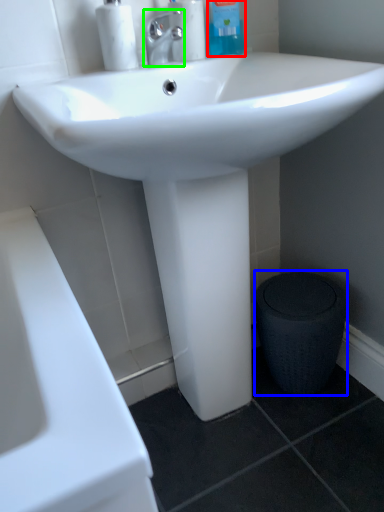
Question: Which object is positioned closest to cleaning product (highlighted by a red box)? Select from porcelain (highlighted by a blue box) and tap (highlighted by a green box).

Choices:
 (A) porcelain
 (B) tap

Answer: (B)